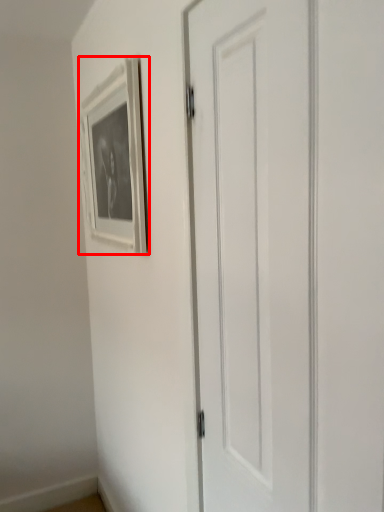
Question: From the image's perspective, considering the relative positions of picture frame (annotated by the red box) and door in the image provided, where is picture frame (annotated by the red box) located with respect to the staircase?

Choices:
 (A) above
 (B) below

Answer: (A)